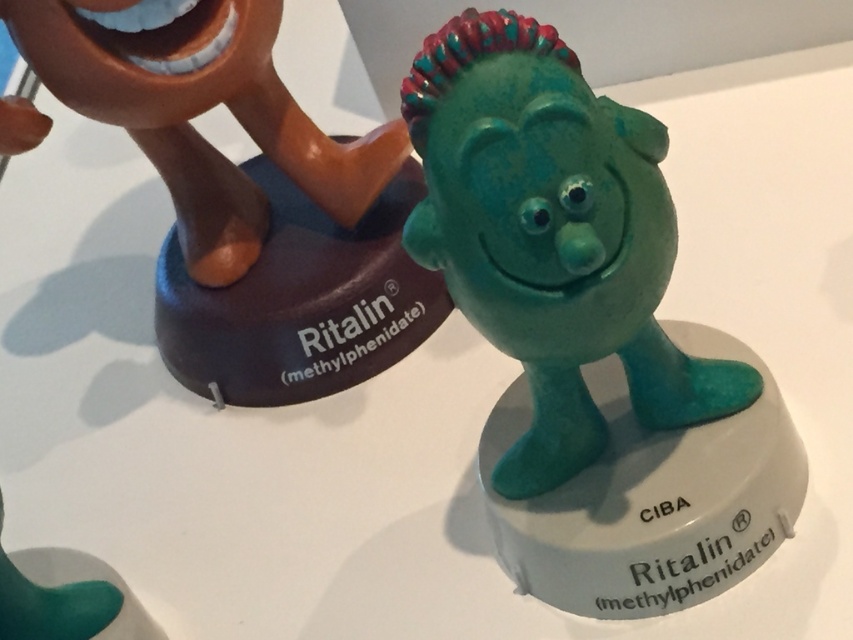
Question: Can you confirm if teal rubber figure at center is bigger than matte brown figure at upper left?

Choices:
 (A) yes
 (B) no

Answer: (B)

Question: Can you confirm if teal rubber figure at center is smaller than matte brown figure at upper left?

Choices:
 (A) no
 (B) yes

Answer: (B)

Question: Which point is closer to the camera taking this photo?

Choices:
 (A) (164, 140)
 (B) (546, 60)

Answer: (B)

Question: Does teal rubber figure at center have a greater width compared to matte brown figure at upper left?

Choices:
 (A) yes
 (B) no

Answer: (B)